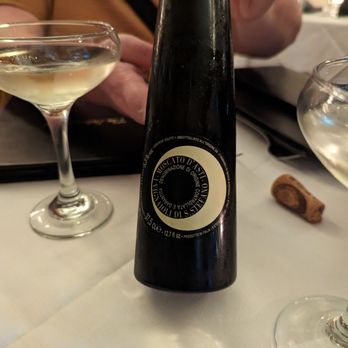
The image size is (348, 348). What are the coordinates of `fork` in the screenshot? It's located at (276, 153).